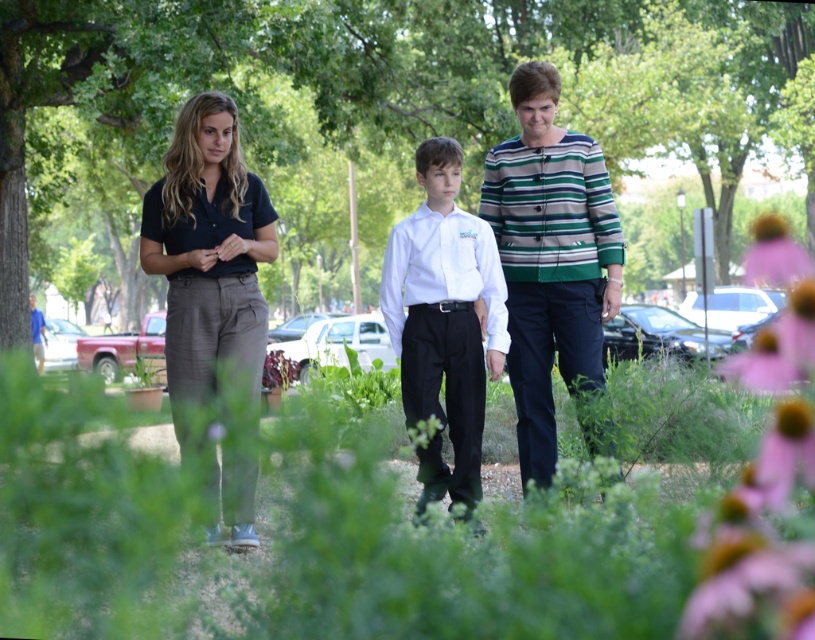
Question: Can you confirm if striped cotton jacket at center is positioned to the left of pink fuzzy flower at upper right?

Choices:
 (A) no
 (B) yes

Answer: (B)

Question: Does striped cotton jacket at center have a lesser width compared to pink soft flower at lower right?

Choices:
 (A) no
 (B) yes

Answer: (B)

Question: Estimate the real-world distances between objects in this image. Which object is farther from the pink soft flower at lower right?

Choices:
 (A) white glossy shirt at center
 (B) pink fuzzy flower at right

Answer: (A)

Question: Is pink fuzzy flower at right smaller than white glossy shirt at center?

Choices:
 (A) no
 (B) yes

Answer: (A)

Question: Which point is farther to the camera?

Choices:
 (A) (457, 328)
 (B) (742, 372)

Answer: (B)

Question: Which of the following is the closest to the observer?

Choices:
 (A) matte black pants at center
 (B) green leafy plants at center
 (C) blue fabric shirt at center
 (D) dark blue cotton shirt at center

Answer: (B)